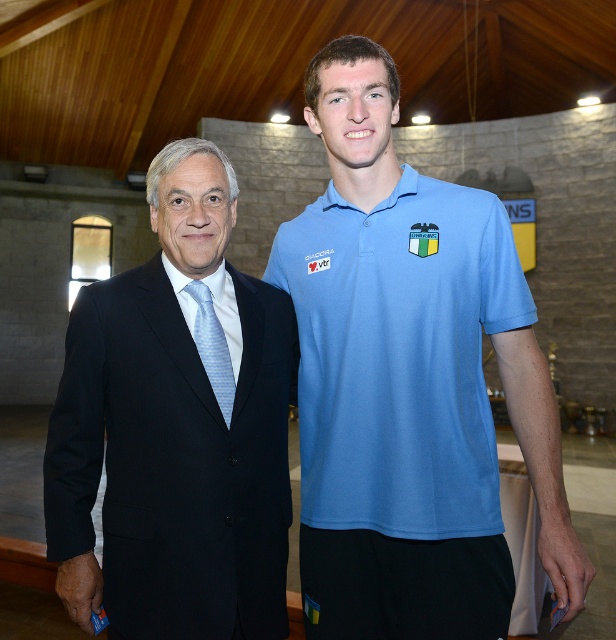
You are a photographer at a formal event. You need to adjust your camera focus to capture both the blue cotton polo shirt at center and the light blue striped tie at left. Which object should you focus on first if you want to ensure the closest subject is in focus?

The light blue striped tie at left should be focused on first because it is closer to the camera than the blue cotton polo shirt at center.

You are a photographer setting up for a group photo. You need to ensure there is at least 18 inches of space between the blue cotton polo shirt at center and the black suit at left for proper framing. Based on the current setup, can you achieve the required spacing?

The current distance between the blue cotton polo shirt at center and the black suit at left is 15.26 inches, which is less than the required 18 inches. Therefore, you need to increase the distance between them to meet the spacing requirement.

Based on the photo, you are a photographer adjusting camera settings for a portrait of the two individuals in the scene. You need to focus on the black suit at left and the light blue silk tie at left. Which object should you adjust the focus for first if you want to ensure both are in focus, considering their relative sizes in the frame?

The black suit at left has a greater height compared to the light blue silk tie at left, so you should focus on the larger object first to ensure depth of field covers both.